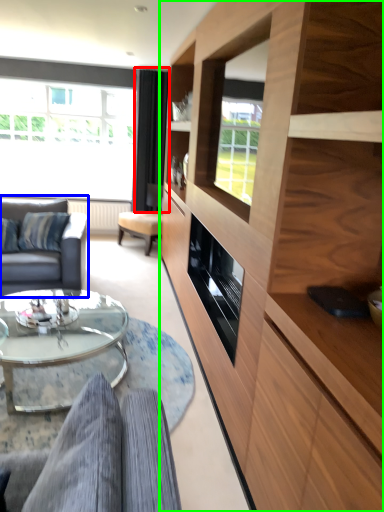
Question: Which is farther away from curtain (highlighted by a red box)? studio couch (highlighted by a blue box) or cabinetry (highlighted by a green box)?

Choices:
 (A) studio couch
 (B) cabinetry

Answer: (B)